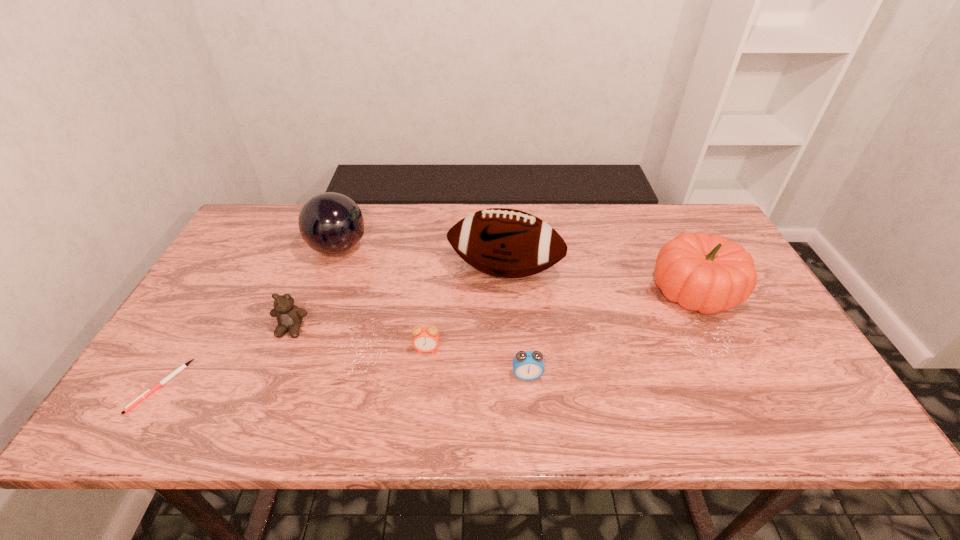
Image resolution: width=960 pixels, height=540 pixels. I want to click on free space located 0.220m on the front of the football (American), so click(510, 363).

Where is `blank area located on the side of the bowling ball with the finger holes`? The image size is (960, 540). blank area located on the side of the bowling ball with the finger holes is located at coordinates (483, 248).

This screenshot has height=540, width=960. In order to click on free location located 0.130m on the front of the pumpkin in this screenshot , I will do `click(732, 366)`.

The height and width of the screenshot is (540, 960). I want to click on vacant space located 0.140m on the face of the teddy bear, so coord(267,389).

Where is `free space located on the face of the left alarm clock`? The image size is (960, 540). free space located on the face of the left alarm clock is located at coordinates (424, 376).

Locate an element on the screen. This screenshot has width=960, height=540. vacant space located on the face of the right alarm clock is located at coordinates (533, 431).

At what (x,y) coordinates should I click in order to perform the action: click on football (American) that is at the far edge. Please return your answer as a coordinate pair (x, y). The image size is (960, 540). Looking at the image, I should click on (507, 243).

Find the location of a particular element. The height and width of the screenshot is (540, 960). bowling ball present at the far edge is located at coordinates (330, 223).

Find the location of a particular element. The image size is (960, 540). object present at the near edge is located at coordinates (149, 391).

The height and width of the screenshot is (540, 960). What are the coordinates of `object situated at the left edge` in the screenshot? It's located at (149, 391).